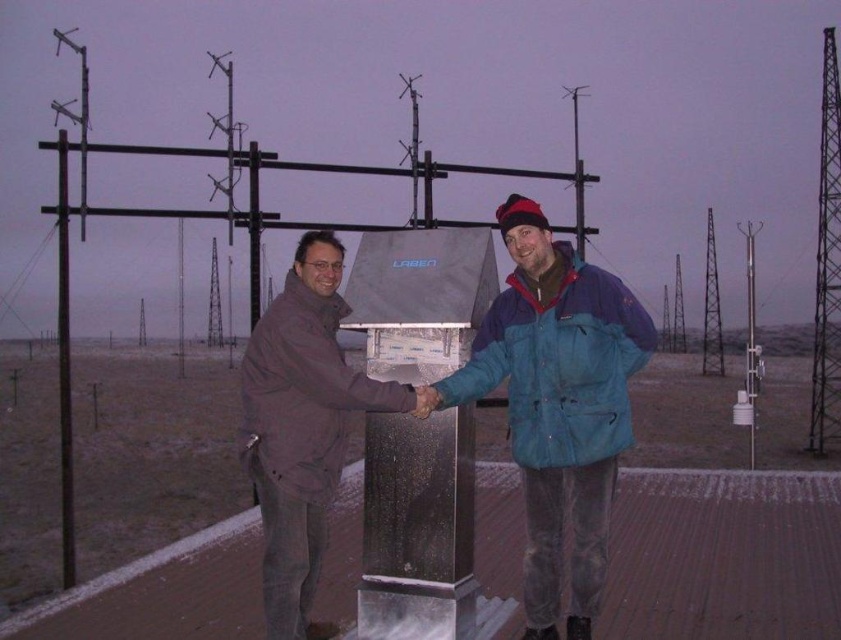
You are a researcher at the remote station and need to retrieve an item from the ground. Which jacket, the blue fabric jacket at center or the brown matte jacket at center, is positioned higher and would require you to bend less to reach the ground?

The brown matte jacket at center is positioned lower since the blue fabric jacket at center is located above it. Therefore, the brown matte jacket at center requires bending less to reach the ground.

You are a maintenance worker who needs to move a 20 meter long cable from the metallic lattice tower at right to the smooth black pole at left. Can you safely stretch the cable between them without any obstacles?

The distance between the metallic lattice tower at right and the smooth black pole at left is 20.71 meters. Since the cable is only 20 meters long, it is too short to span the distance between them. You would need a longer cable to safely stretch it between the two without any obstacles.